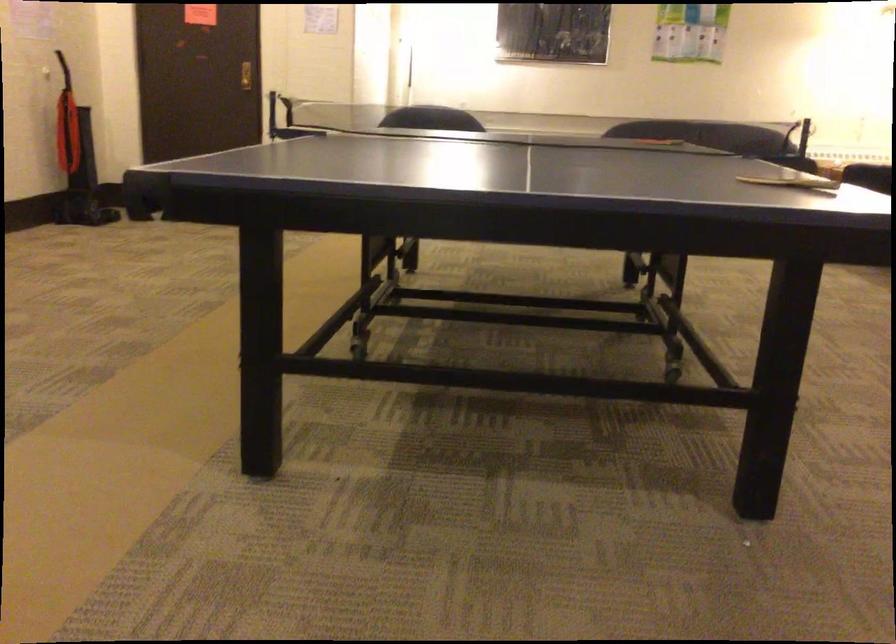
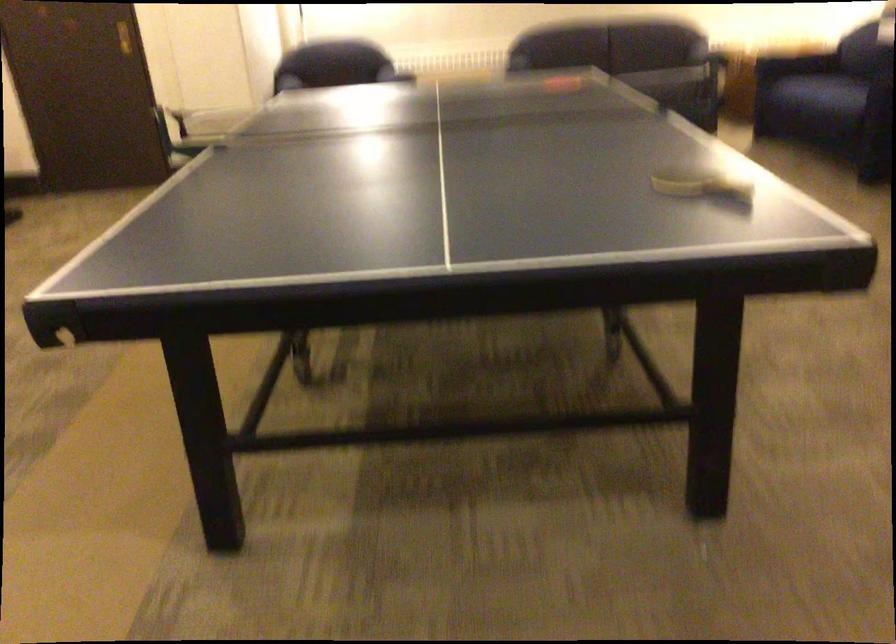
Find the pixel in the second image that matches point (785, 178) in the first image.

(701, 184)